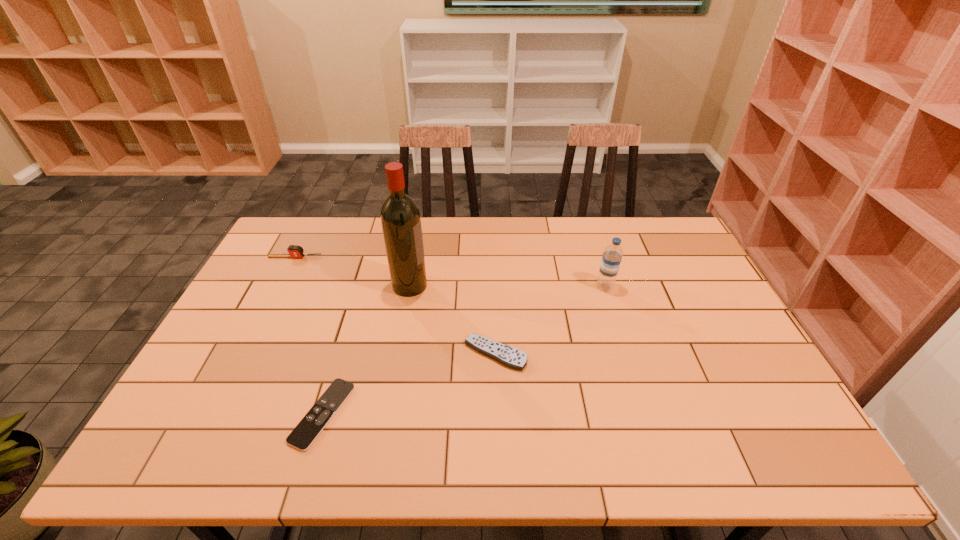
This screenshot has width=960, height=540. Find the location of `free location that satisfies the following two spatial constraints: 1. on the label of the second nearest object; 2. on the right side of the third object from left to right`. free location that satisfies the following two spatial constraints: 1. on the label of the second nearest object; 2. on the right side of the third object from left to right is located at coordinates (397, 354).

Find the location of a particular element. This screenshot has width=960, height=540. blank space that satisfies the following two spatial constraints: 1. on the label of the tallest object; 2. on the front side of the nearer remote control is located at coordinates tap(387, 414).

Find the location of a particular element. The height and width of the screenshot is (540, 960). free region that satisfies the following two spatial constraints: 1. on the label of the wine bottle; 2. on the back side of the second object from right to left is located at coordinates (397, 354).

Where is `vacant space that satisfies the following two spatial constraints: 1. on the front side of the farther remote control; 2. on the left side of the leftmost object`? The width and height of the screenshot is (960, 540). vacant space that satisfies the following two spatial constraints: 1. on the front side of the farther remote control; 2. on the left side of the leftmost object is located at coordinates (247, 354).